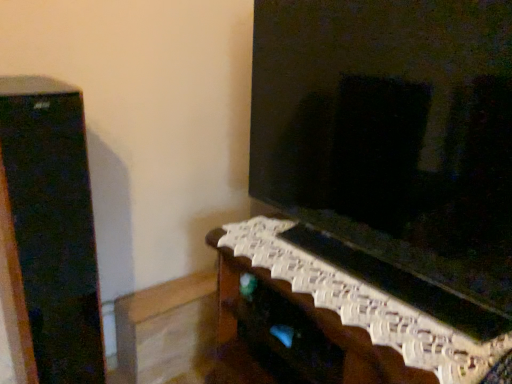
Where is `vacant region above white woven basket at lower right (from a real-world perspective)`? The image size is (512, 384). vacant region above white woven basket at lower right (from a real-world perspective) is located at coordinates (343, 275).